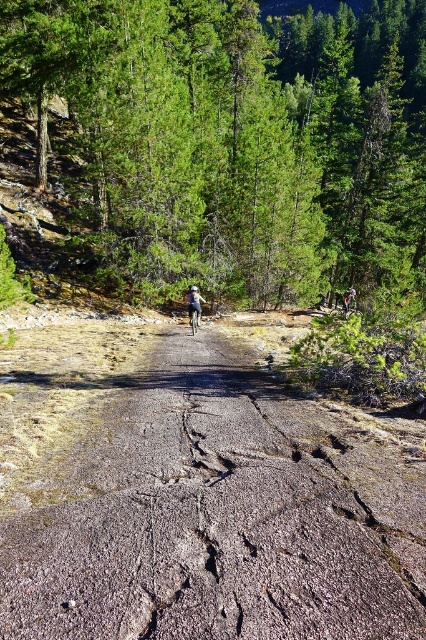
Question: Is green leafy tree at center to the right of silver metallic mountain bike at center from the viewer's perspective?

Choices:
 (A) yes
 (B) no

Answer: (A)

Question: Does green leafy tree at center have a greater width compared to silver metallic mountain bike at center?

Choices:
 (A) yes
 (B) no

Answer: (A)

Question: Among these objects, which one is nearest to the camera?

Choices:
 (A) green leafy tree at center
 (B) silver metallic mountain bike at center

Answer: (B)

Question: Considering the relative positions of brown cracked dirt at center and silver metallic mountain bike at center in the image provided, where is brown cracked dirt at center located with respect to silver metallic mountain bike at center?

Choices:
 (A) left
 (B) right

Answer: (B)

Question: Which object is farther from the camera taking this photo?

Choices:
 (A) green leafy tree at center
 (B) brown cracked dirt at center

Answer: (A)

Question: Which of these objects is positioned farthest from the silver metallic mountain bike at center?

Choices:
 (A) green leafy tree at center
 (B) brown cracked dirt at center

Answer: (A)